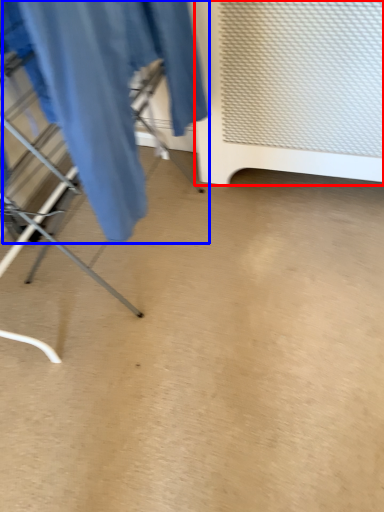
Question: Among these objects, which one is farthest to the camera, furniture (highlighted by a red box) or clothing (highlighted by a blue box)?

Choices:
 (A) furniture
 (B) clothing

Answer: (A)